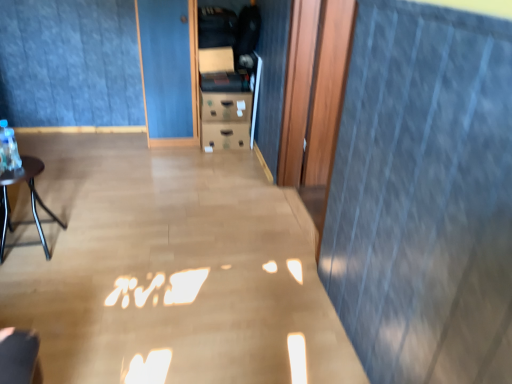
I want to click on vacant space behind matte black table at left, so click(67, 220).